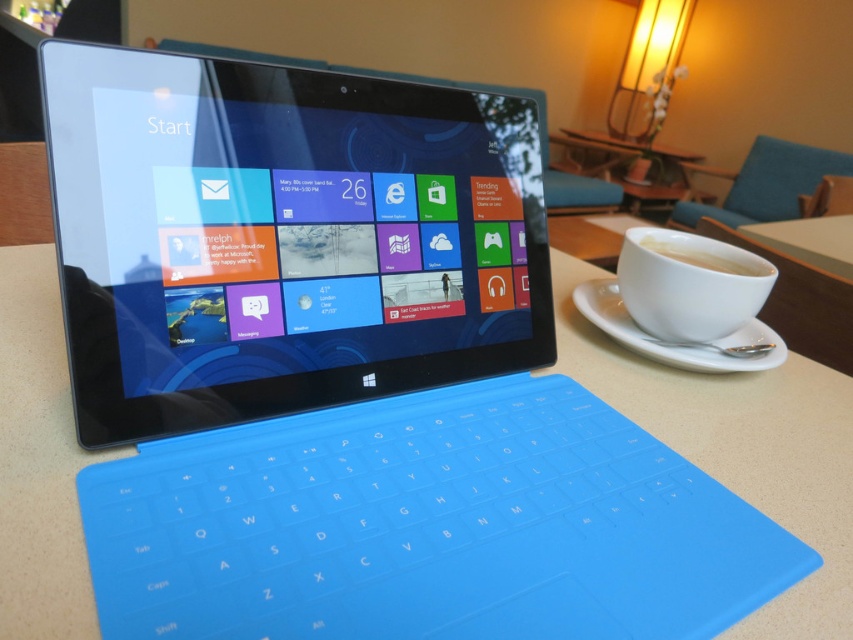
Question: Which point is closer to the camera taking this photo?

Choices:
 (A) (752, 333)
 (B) (756, 264)

Answer: (B)

Question: Can you confirm if white ceramic saucer at right is wider than white matte cup at right?

Choices:
 (A) yes
 (B) no

Answer: (A)

Question: Which of the following is the closest to the observer?

Choices:
 (A) white ceramic saucer at right
 (B) white matte cup at right

Answer: (A)

Question: Is white ceramic saucer at right wider than white matte cup at right?

Choices:
 (A) yes
 (B) no

Answer: (A)

Question: Does white ceramic saucer at right have a smaller size compared to white matte cup at right?

Choices:
 (A) yes
 (B) no

Answer: (B)